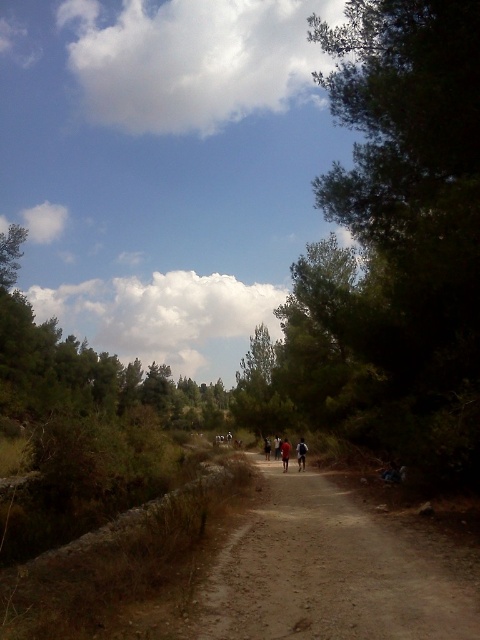
Question: Which point is farther to the camera?

Choices:
 (A) dark blue fabric at center
 (B) dirt path at center

Answer: (A)

Question: In this image, where is dark blue jeans at center located relative to dark blue shirt at center?

Choices:
 (A) left
 (B) right

Answer: (B)

Question: Is dirt path at center further to camera compared to dark blue shirt at center?

Choices:
 (A) no
 (B) yes

Answer: (A)

Question: Which point appears closest to the camera in this image?

Choices:
 (A) (300, 445)
 (B) (284, 468)
 (C) (269, 452)
 (D) (269, 588)

Answer: (D)

Question: Which of the following is the closest to the observer?

Choices:
 (A) (288, 456)
 (B) (215, 596)
 (C) (268, 445)

Answer: (B)

Question: Can you confirm if dirt path at center is smaller than dark blue shirt at center?

Choices:
 (A) yes
 (B) no

Answer: (B)